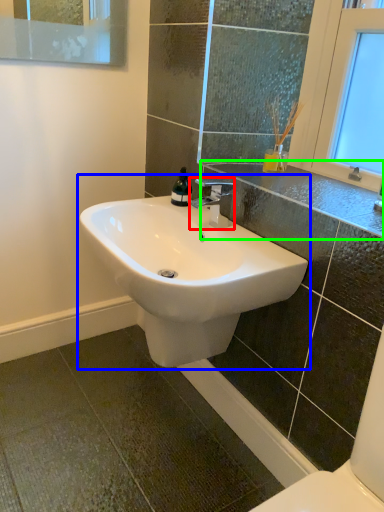
Question: Which is farther away from tap (highlighted by a red box)? sink (highlighted by a blue box) or counter top (highlighted by a green box)?

Choices:
 (A) sink
 (B) counter top

Answer: (A)